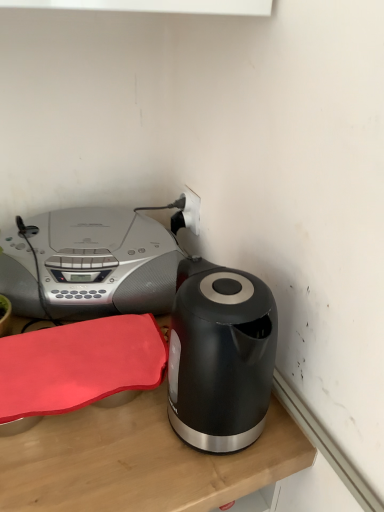
This screenshot has width=384, height=512. What do you see at coordinates (90, 265) in the screenshot?
I see `satin silver stereo at upper left` at bounding box center [90, 265].

This screenshot has height=512, width=384. Describe the element at coordinates (191, 209) in the screenshot. I see `white plastic plug at upper center` at that location.

Identify the location of satin silver stereo at upper left. The height and width of the screenshot is (512, 384). (90, 265).

Does white plastic plug at upper center have a greater width compared to wooden table at lower left?

No.

Would you say white plastic plug at upper center is a long distance from wooden table at lower left?

No, there isn't a large distance between white plastic plug at upper center and wooden table at lower left.

From the picture: Can you confirm if white plastic plug at upper center is positioned to the left of wooden table at lower left?

In fact, white plastic plug at upper center is to the right of wooden table at lower left.

Between point (195, 214) and point (138, 428), which one is positioned behind?

The point (195, 214) is behind.

Can you tell me how much satin silver stereo at upper left and white plastic plug at upper center differ in facing direction?

The facing directions of satin silver stereo at upper left and white plastic plug at upper center are 91.4 degrees apart.

Is satin silver stereo at upper left positioned beyond the bounds of white plastic plug at upper center?

That's correct, satin silver stereo at upper left is outside of white plastic plug at upper center.

Considering the points (163, 303) and (194, 210), which point is in front, point (163, 303) or point (194, 210)?

The point (163, 303) is closer.

Is satin silver stereo at upper left closer to the viewer compared to white plastic plug at upper center?

Yes, satin silver stereo at upper left is closer to the viewer.

Can you tell me how much wooden table at lower left and white plastic plug at upper center differ in facing direction?

91.4 degrees separate the facing orientations of wooden table at lower left and white plastic plug at upper center.

Is wooden table at lower left placed right next to white plastic plug at upper center?

wooden table at lower left and white plastic plug at upper center are clearly separated.

Is point (19, 468) behind point (197, 217)?

No, (19, 468) is closer to viewer.

In terms of height, does wooden table at lower left look taller or shorter compared to white plastic plug at upper center?

Considering their sizes, wooden table at lower left has more height than white plastic plug at upper center.

Is wooden table at lower left aimed at satin silver stereo at upper left?

No, wooden table at lower left does not turn towards satin silver stereo at upper left.

Is point (170, 504) behind point (39, 265)?

No, (170, 504) is closer to viewer.

Consider the image. Is wooden table at lower left taller or shorter than satin silver stereo at upper left?

In the image, wooden table at lower left appears to be shorter than satin silver stereo at upper left.

Is wooden table at lower left in front of or behind satin silver stereo at upper left in the image?

wooden table at lower left is in front of satin silver stereo at upper left.

How different are the orientations of white plastic plug at upper center and satin silver stereo at upper left in degrees?

91.4 degrees separate the facing orientations of white plastic plug at upper center and satin silver stereo at upper left.

Is white plastic plug at upper center surrounding satin silver stereo at upper left?

That's incorrect, satin silver stereo at upper left is not inside white plastic plug at upper center.

I want to click on electric outlet positioned vertically above the satin silver stereo at upper left (from a real-world perspective), so click(191, 209).

Considering the sizes of objects white plastic plug at upper center and satin silver stereo at upper left in the image provided, who is shorter, white plastic plug at upper center or satin silver stereo at upper left?

white plastic plug at upper center is shorter.

Can you confirm if satin silver stereo at upper left is thinner than wooden table at lower left?

In fact, satin silver stereo at upper left might be wider than wooden table at lower left.

Would you say satin silver stereo at upper left is to the left or to the right of wooden table at lower left in the picture?

satin silver stereo at upper left is positioned on wooden table at lower left's left side.

Does point (42, 225) come behind point (43, 449)?

Yes, point (42, 225) is farther from viewer.

From the picture: Is wooden table at lower left located within satin silver stereo at upper left?

No, wooden table at lower left is not surrounded by satin silver stereo at upper left.

This screenshot has height=512, width=384. What are the coordinates of `table in front of the white plastic plug at upper center` in the screenshot? It's located at (139, 461).

Where is `home appliance located on the left of white plastic plug at upper center`? home appliance located on the left of white plastic plug at upper center is located at coordinates (90, 265).

Estimate the real-world distances between objects in this image. Which object is further from white plastic plug at upper center, satin silver stereo at upper left or wooden table at lower left?

Among the two, wooden table at lower left is located further to white plastic plug at upper center.

When comparing their distances from wooden table at lower left, does satin silver stereo at upper left or white plastic plug at upper center seem further?

white plastic plug at upper center is positioned further to the anchor wooden table at lower left.

Estimate the real-world distances between objects in this image. Which object is further from white plastic plug at upper center, wooden table at lower left or satin silver stereo at upper left?

wooden table at lower left is positioned further to the anchor white plastic plug at upper center.

From the image, which object appears to be farther from wooden table at lower left, white plastic plug at upper center or satin silver stereo at upper left?

white plastic plug at upper center is further to wooden table at lower left.

From the image, which object appears to be farther from satin silver stereo at upper left, white plastic plug at upper center or wooden table at lower left?

Among the two, wooden table at lower left is located further to satin silver stereo at upper left.

Estimate the real-world distances between objects in this image. Which object is closer to satin silver stereo at upper left, wooden table at lower left or white plastic plug at upper center?

white plastic plug at upper center lies closer to satin silver stereo at upper left than the other object.

The image size is (384, 512). In order to click on home appliance between wooden table at lower left and white plastic plug at upper center from front to back in this screenshot , I will do `click(90, 265)`.